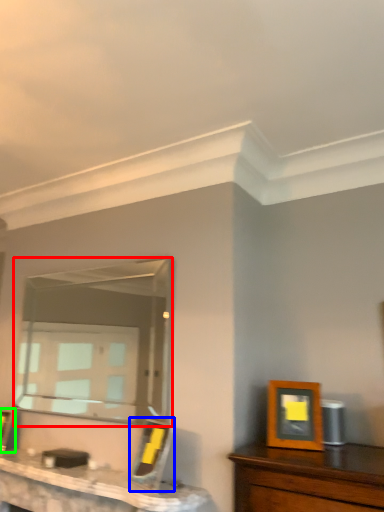
Question: Considering the real-world distances, which object is closest to mirror (highlighted by a red box)? picture frame (highlighted by a blue box) or picture frame (highlighted by a green box).

Choices:
 (A) picture frame
 (B) picture frame

Answer: (B)